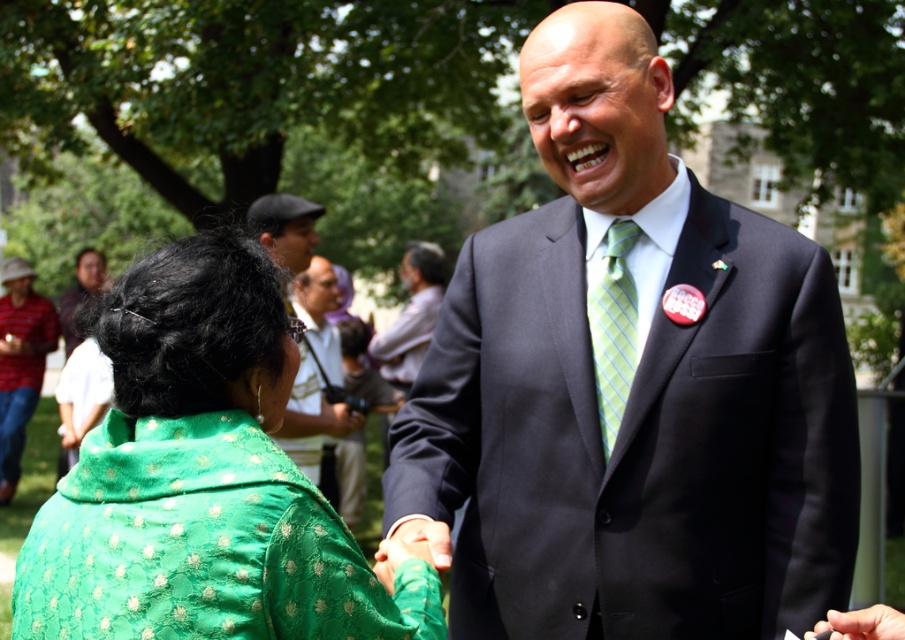
Question: Can you confirm if green plaid tie at center is positioned above light purple shirt at center?

Choices:
 (A) yes
 (B) no

Answer: (B)

Question: Which of the following is the farthest from the observer?

Choices:
 (A) (873, 618)
 (B) (132, 592)
 (C) (618, 365)
 (D) (49, 330)

Answer: (D)

Question: Can you confirm if green plaid tie at center is positioned to the right of matte black suit at upper center?

Choices:
 (A) yes
 (B) no

Answer: (A)

Question: Which of the following is the closest to the observer?

Choices:
 (A) light brown leather jacket at center
 (B) matte black suit at upper center
 (C) smooth skin hand at center
 (D) matte black cap at upper center

Answer: (C)

Question: Can you confirm if light brown leather jacket at center is positioned below light purple shirt at center?

Choices:
 (A) no
 (B) yes

Answer: (B)

Question: Among these objects, which one is nearest to the camera?

Choices:
 (A) matte black cap at upper center
 (B) smooth skin hand at center
 (C) green plaid tie at center
 (D) matte black suit at upper center

Answer: (B)